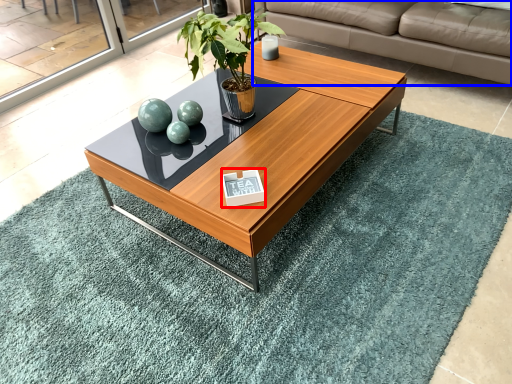
Question: Which of the following is the closest to the observer, plaque (highlighted by a red box) or studio couch (highlighted by a blue box)?

Choices:
 (A) plaque
 (B) studio couch

Answer: (A)